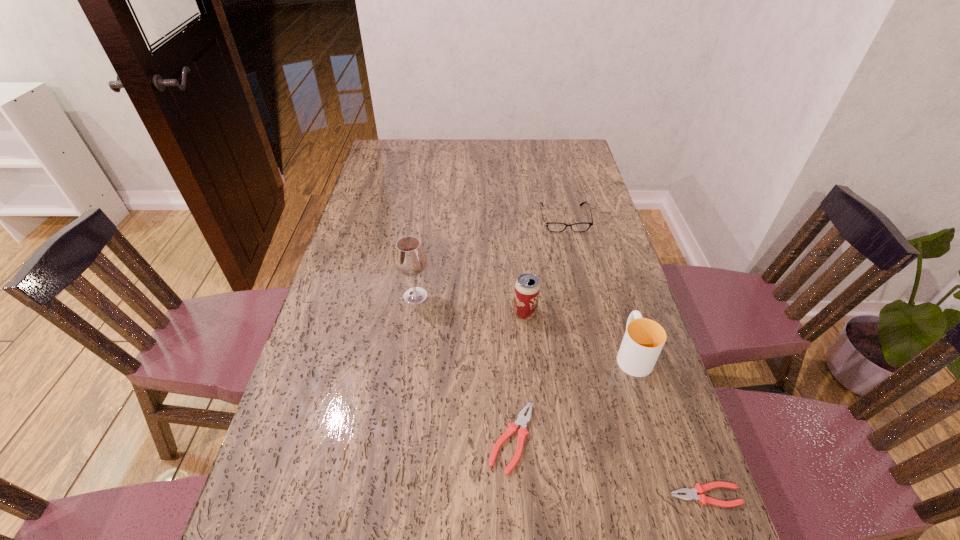
This screenshot has width=960, height=540. In order to click on free location located on the left of the fifth farthest object in this screenshot , I will do `click(443, 438)`.

I want to click on vacant space located 0.300m on the left of the shortest object, so click(521, 495).

The width and height of the screenshot is (960, 540). Identify the location of vacant space located on the front-facing side of the farthest object. (576, 269).

In order to click on free space located 0.050m with the handle on the side of the cup in this screenshot , I will do `click(622, 319)`.

You are a GUI agent. You are given a task and a screenshot of the screen. Output one action in this format:
    pyautogui.click(x=<x>, y=<y>)
    Task: Click on the vacant position located 0.050m with the handle on the side of the cup
    This screenshot has width=960, height=540.
    Given the screenshot: What is the action you would take?
    pyautogui.click(x=622, y=319)

Identify the location of free region located 0.060m with the handle on the side of the cup. The width and height of the screenshot is (960, 540). (621, 316).

What are the coordinates of `vacant space located on the front of the leftmost object` in the screenshot? It's located at [x=396, y=427].

Locate an element on the screen. Image resolution: width=960 pixels, height=540 pixels. vacant space situated on the front of the beer can is located at coordinates (535, 412).

Locate an element on the screen. object located in the near edge section of the desktop is located at coordinates (691, 494).

The height and width of the screenshot is (540, 960). Find the location of `pliers at the right edge`. pliers at the right edge is located at coordinates (691, 494).